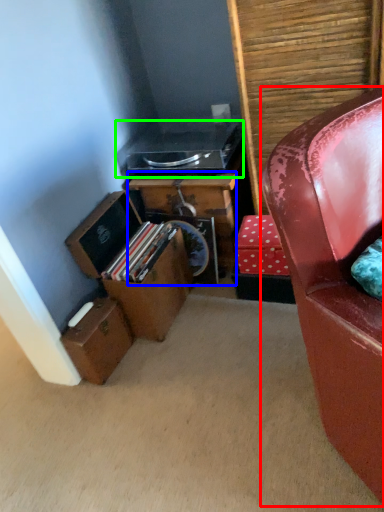
Question: Based on their relative distances, which object is nearer to chair (highlighted by a red box)? Choose from desk (highlighted by a blue box) and stereo (highlighted by a green box).

Choices:
 (A) desk
 (B) stereo

Answer: (A)